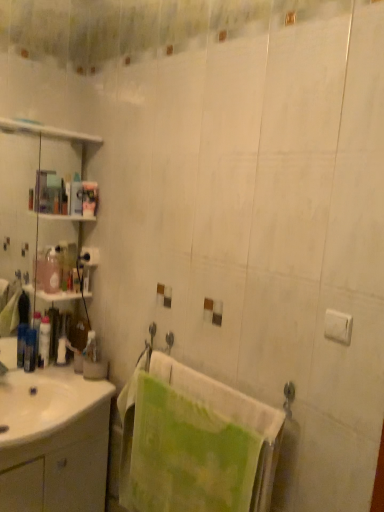
Question: Based on their sizes in the image, would you say pink glossy bottle at left, marked as the 3th toiletry in a left-to-right arrangement, is bigger or smaller than white matte toilet paper at upper left?

Choices:
 (A) small
 (B) big

Answer: (B)

Question: Considering the positions of point (46, 285) and point (84, 264), is point (46, 285) closer or farther from the camera than point (84, 264)?

Choices:
 (A) farther
 (B) closer

Answer: (B)

Question: Which object is the farthest from the green textured towel at center?

Choices:
 (A) white glossy lotion at left, marked as the 2th toiletry in a left-to-right arrangement
 (B) translucent plastic bottle at left, the 1th toiletry from the left
 (C) white glossy cabinet at lower left
 (D) pink glossy bottle at left, marked as the 3th toiletry in a left-to-right arrangement
 (E) white matte toilet paper at upper left

Answer: (D)

Question: Which object is the farthest from the translucent plastic bottle at left, the 1th toiletry from the left?

Choices:
 (A) green textured towel at center
 (B) white matte toilet paper at upper left
 (C) translucent plastic bottle at left, acting as the first toiletry starting from the right
 (D) white glossy cabinet at lower left
 (E) white glossy lotion at left, marked as the 2th toiletry in a left-to-right arrangement

Answer: (A)